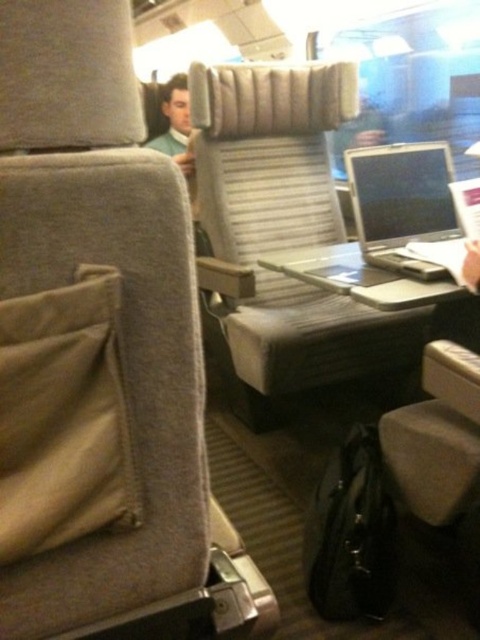
You are sitting in a train car and want to place your laptop on the seat backrest pocket. The seat backrest pocket is located at point (x=403, y=204). Is the satin silver laptop at center near the seat backrest pocket?

The point (x=403, y=204) corresponds to the satin silver laptop at center, so yes, the satin silver laptop at center is near the seat backrest pocket.

You are a passenger on a train and want to place your satin silver laptop at center and metallic gray tray at center on the seat in front of you. The seatback has a storage pocket. Which item would you place in the storage pocket to ensure both items fit?

The satin silver laptop at center is much taller than the metallic gray tray at center, so you should place the satin silver laptop at center in the storage pocket to ensure both items fit.